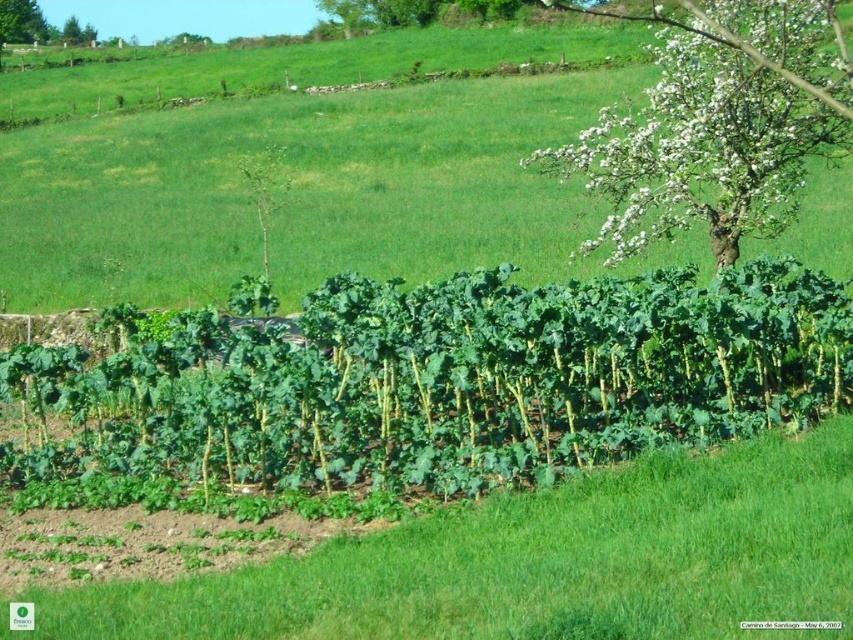
Can you confirm if green leafy plant at center is positioned to the left of white blossoming tree at upper right?

Correct, you'll find green leafy plant at center to the left of white blossoming tree at upper right.

Does green leafy plant at center have a lesser width compared to white blossoming tree at upper right?

Indeed, green leafy plant at center has a lesser width compared to white blossoming tree at upper right.

Where is `green leafy plant at center`? This screenshot has height=640, width=853. green leafy plant at center is located at coordinates (430, 385).

Describe the element at coordinates (700, 148) in the screenshot. I see `white blossoming tree at upper right` at that location.

Which is more to the right, white blossoming tree at upper right or green leafy plant at upper left?

Positioned to the right is white blossoming tree at upper right.

At what (x,y) coordinates should I click in order to perform the action: click on white blossoming tree at upper right. Please return your answer as a coordinate pair (x, y). This screenshot has width=853, height=640. Looking at the image, I should click on (700, 148).

Does green leafy plant at center appear under green leafy plant at upper left?

Correct, green leafy plant at center is located below green leafy plant at upper left.

Describe the element at coordinates (430, 385) in the screenshot. I see `green leafy plant at center` at that location.

Who is more distant from viewer, [802,417] or [26,20]?

The point [26,20] is more distant.

Image resolution: width=853 pixels, height=640 pixels. In order to click on green leafy plant at center in this screenshot , I will do `click(430, 385)`.